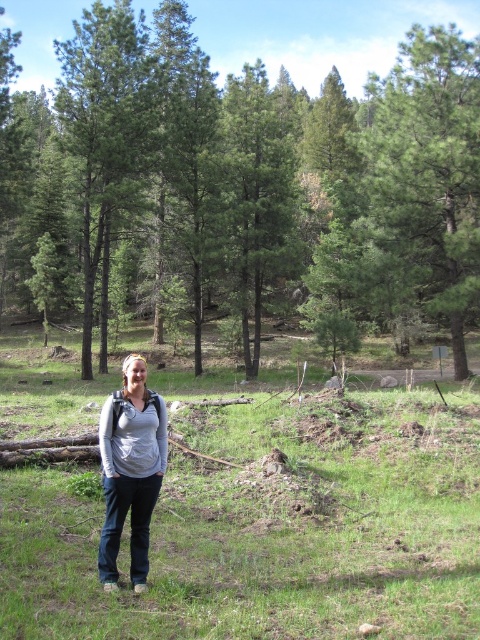
Question: From the image, what is the correct spatial relationship of green matte tree at center in relation to gray matte shirt at center?

Choices:
 (A) right
 (B) left

Answer: (A)

Question: Can you confirm if green matte trees at center is positioned to the left of green matte tree at center?

Choices:
 (A) no
 (B) yes

Answer: (B)

Question: Which point is closer to the camera?

Choices:
 (A) (468, 307)
 (B) (136, 525)

Answer: (B)

Question: Considering the real-world distances, which object is closest to the green grass at center?

Choices:
 (A) green matte trees at center
 (B) green matte tree at upper right
 (C) green matte tree at center
 (D) gray matte shirt at center

Answer: (D)

Question: Does green grass at center appear on the right side of gray matte shirt at center?

Choices:
 (A) yes
 (B) no

Answer: (B)

Question: Which of the following is the closest to the observer?

Choices:
 (A) green matte tree at upper right
 (B) gray matte shirt at center

Answer: (B)